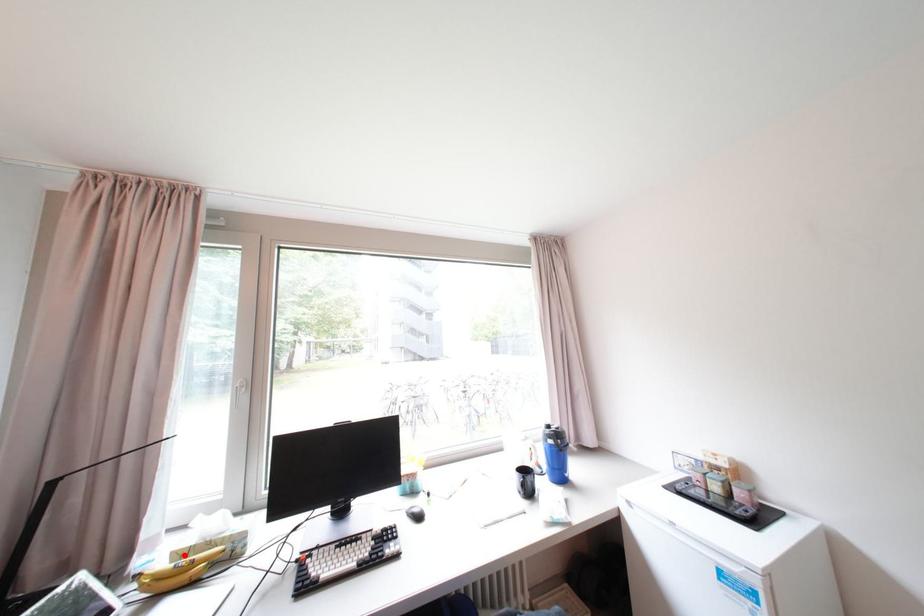
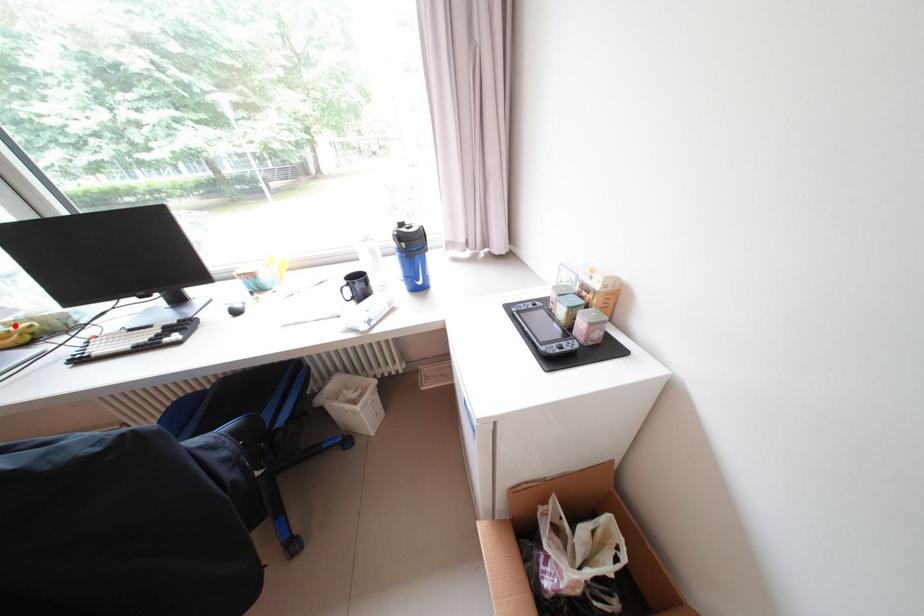
I am providing you with two images of the same scene from different viewpoints. A red point is marked on the first image and another point is marked on the second image. Are the points marked in image1 and image2 representing the same 3D position?

Yes